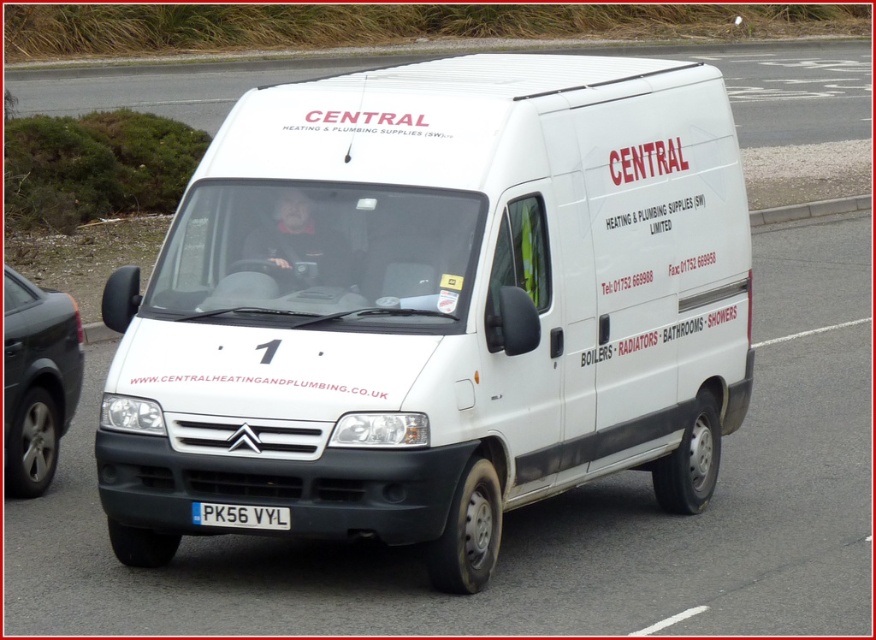
Who is higher up, white matte van at center or silver metallic van at left?

white matte van at center

Can you confirm if white matte van at center is shorter than silver metallic van at left?

No.

Describe the element at coordinates (436, 307) in the screenshot. The image size is (876, 640). I see `white matte van at center` at that location.

The image size is (876, 640). What are the coordinates of `white matte van at center` in the screenshot? It's located at (436, 307).

Who is lower down, white matte van at center or white plastic license plate at center?

white plastic license plate at center is below.

Is white matte van at center shorter than white plastic license plate at center?

No.

Is point (244, 464) positioned after point (259, 515)?

That is False.

This screenshot has height=640, width=876. Find the location of `white matte van at center`. white matte van at center is located at coordinates (436, 307).

Is silver metallic van at left bigger than white plastic license plate at center?

Indeed, silver metallic van at left has a larger size compared to white plastic license plate at center.

From the picture: Is silver metallic van at left below white plastic license plate at center?

Actually, silver metallic van at left is above white plastic license plate at center.

The width and height of the screenshot is (876, 640). Describe the element at coordinates (37, 380) in the screenshot. I see `silver metallic van at left` at that location.

You are a GUI agent. You are given a task and a screenshot of the screen. Output one action in this format:
    pyautogui.click(x=<x>, y=<y>)
    Task: Click on the silver metallic van at left
    
    Given the screenshot: What is the action you would take?
    pyautogui.click(x=37, y=380)